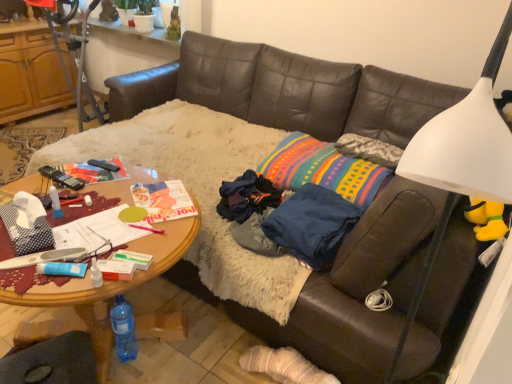
At what (x,y) coordinates should I click in order to perform the action: click on woodendesk at center. Please return your answer as a coordinate pair (x, y). Looking at the image, I should click on (x=101, y=293).

Where is `dark blue fabric at center`? This screenshot has height=384, width=512. dark blue fabric at center is located at coordinates (312, 224).

Find the location of a particular element. Image resolution: width=512 pixels, height=384 pixels. multicolored woven pillow at center is located at coordinates [323, 169].

Where is `black leather swivel chair at lower left`? The image size is (512, 384). black leather swivel chair at lower left is located at coordinates (52, 362).

At what (x,y) coordinates should I click in order to perform the action: click on brown leather couch at center. Please return your answer as a coordinate pair (x, y). The height and width of the screenshot is (384, 512). Looking at the image, I should click on (286, 91).

Identify the location of swivel chair that appears below the woodendesk at center (from a real-world perspective). Image resolution: width=512 pixels, height=384 pixels. (52, 362).

From the picture: From a real-world perspective, is woodendesk at center over black leather swivel chair at lower left?

Yes, from a real-world perspective, woodendesk at center is over black leather swivel chair at lower left

Considering the sizes of woodendesk at center and black leather swivel chair at lower left in the image, is woodendesk at center bigger or smaller than black leather swivel chair at lower left?

In the image, woodendesk at center appears to be larger than black leather swivel chair at lower left.

Is black leather swivel chair at lower left further to the viewer compared to black plastic remote control at center?

No, it is not.

How many degrees apart are the facing directions of black leather swivel chair at lower left and black plastic remote control at center?

They differ by 124 degrees in their facing directions.

Can you see black leather swivel chair at lower left touching black plastic remote control at center?

No, black leather swivel chair at lower left is not beside black plastic remote control at center.

From the image's perspective, is black leather swivel chair at lower left above woodendesk at center?

Incorrect, from the image's perspective, black leather swivel chair at lower left is lower than woodendesk at center.

Which of these two, black leather swivel chair at lower left or woodendesk at center, is smaller?

Smaller between the two is black leather swivel chair at lower left.

What's the angular difference between black leather swivel chair at lower left and woodendesk at center's facing directions?

There is a 23-degree angle between the facing directions of black leather swivel chair at lower left and woodendesk at center.

From a real-world perspective, is black leather swivel chair at lower left physically above woodendesk at center?

No, from a real-world perspective, black leather swivel chair at lower left is not over woodendesk at center

How many degrees apart are the facing directions of woodendesk at center and brown leather couch at center?

4.55 degrees separate the facing orientations of woodendesk at center and brown leather couch at center.

Measure the distance between woodendesk at center and brown leather couch at center.

woodendesk at center and brown leather couch at center are 4.53 feet apart.

Considering the points (80, 304) and (348, 282), which point is in front, point (80, 304) or point (348, 282)?

Point (348, 282)

Can you confirm if woodendesk at center is smaller than brown leather couch at center?

Correct, woodendesk at center occupies less space than brown leather couch at center.

From a real-world perspective, which object stands above the other?

multicolored woven pillow at center, from a real-world perspective.

Is multicolored woven pillow at center positioned in front of brown leather couch at center?

No, multicolored woven pillow at center is further to the viewer.

Is multicolored woven pillow at center smaller than brown leather couch at center?

Yes.

Consider the image. Which is more to the left, multicolored woven pillow at center or brown leather couch at center?

From the viewer's perspective, brown leather couch at center appears more on the left side.

From their relative heights in the image, would you say brown leather couch at center is taller or shorter than white plastic lampshade at upper right?

brown leather couch at center is shorter than white plastic lampshade at upper right.

How different are the orientations of brown leather couch at center and white plastic lampshade at upper right in degrees?

They differ by 88.4 degrees in their facing directions.

Is the surface of brown leather couch at center in direct contact with white plastic lampshade at upper right?

There is a gap between brown leather couch at center and white plastic lampshade at upper right.

Which is less distant, [145,274] or [469,155]?

Point [145,274] is positioned farther from the camera compared to point [469,155].

In the scene shown: What's the angular difference between woodendesk at center and white plastic lampshade at upper right's facing directions?

The facing directions of woodendesk at center and white plastic lampshade at upper right are 83.8 degrees apart.

Does woodendesk at center turn towards white plastic lampshade at upper right?

No, woodendesk at center does not turn towards white plastic lampshade at upper right.

In the scene shown: From a real-world perspective, which is physically above, woodendesk at center or white plastic lampshade at upper right?

white plastic lampshade at upper right, from a real-world perspective.

Where is `swivel chair to the left of woodendesk at center`? Image resolution: width=512 pixels, height=384 pixels. swivel chair to the left of woodendesk at center is located at coordinates (52, 362).

You are a GUI agent. You are given a task and a screenshot of the screen. Output one action in this format:
    pyautogui.click(x=<x>, y=<y>)
    Task: Click on the swivel chair below the black plastic remote control at center (from a real-world perspective)
    Image resolution: width=512 pixels, height=384 pixels.
    Given the screenshot: What is the action you would take?
    pyautogui.click(x=52, y=362)

Which object lies nearer to the anchor point black plastic remote control at center, brown leather couch at center or dark blue fabric at center?

dark blue fabric at center is positioned closer to the anchor black plastic remote control at center.

Looking at the image, which one is located further to multicolored woven pillow at center, brown leather couch at center or black leather swivel chair at lower left?

Among the two, black leather swivel chair at lower left is located further to multicolored woven pillow at center.

Estimate the real-world distances between objects in this image. Which object is further from dark blue fabric at center, woodendesk at center or multicolored woven pillow at center?

woodendesk at center is positioned further to the anchor dark blue fabric at center.

When comparing their distances from black leather swivel chair at lower left, does white plastic lampshade at upper right or dark blue fabric at center seem further?

Among the two, white plastic lampshade at upper right is located further to black leather swivel chair at lower left.

Which object lies nearer to the anchor point white plastic lampshade at upper right, multicolored woven pillow at center or brown leather couch at center?

Among the two, multicolored woven pillow at center is located nearer to white plastic lampshade at upper right.

Which object lies further to the anchor point dark blue fabric at center, black plastic remote control at center or white plastic lampshade at upper right?

black plastic remote control at center is positioned further to the anchor dark blue fabric at center.

Which object lies nearer to the anchor point black leather swivel chair at lower left, multicolored woven pillow at center or woodendesk at center?

woodendesk at center.

Looking at the image, which one is located further to white plastic lampshade at upper right, black plastic remote control at center or woodendesk at center?

The object further to white plastic lampshade at upper right is black plastic remote control at center.

Identify the location of desk that lies between brown leather couch at center and black leather swivel chair at lower left from top to bottom. The width and height of the screenshot is (512, 384). (101, 293).

Locate an element on the screen. studio couch between white plastic lampshade at upper right and multicolored woven pillow at center along the z-axis is located at coordinates (286, 91).

I want to click on studio couch between black plastic remote control at center and multicolored woven pillow at center from left to right, so click(x=286, y=91).

Locate an element on the screen. clothing between woodendesk at center and multicolored woven pillow at center from left to right is located at coordinates (312, 224).